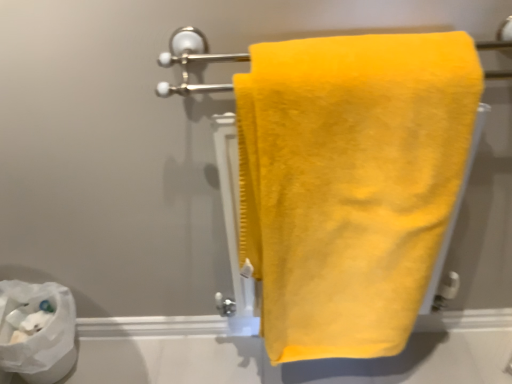
Question: In terms of height, does satin yellow towel at center look taller or shorter compared to yellow fluffy towel at center?

Choices:
 (A) short
 (B) tall

Answer: (A)

Question: From a real-world perspective, is satin yellow towel at center positioned above or below yellow fluffy towel at center?

Choices:
 (A) above
 (B) below

Answer: (A)

Question: Which of these objects is positioned closest to the yellow fluffy towel at center?

Choices:
 (A) satin yellow towel at center
 (B) white paper at lower left

Answer: (A)

Question: Considering the real-world distances, which object is closest to the yellow fluffy towel at center?

Choices:
 (A) satin yellow towel at center
 (B) white paper at lower left

Answer: (A)